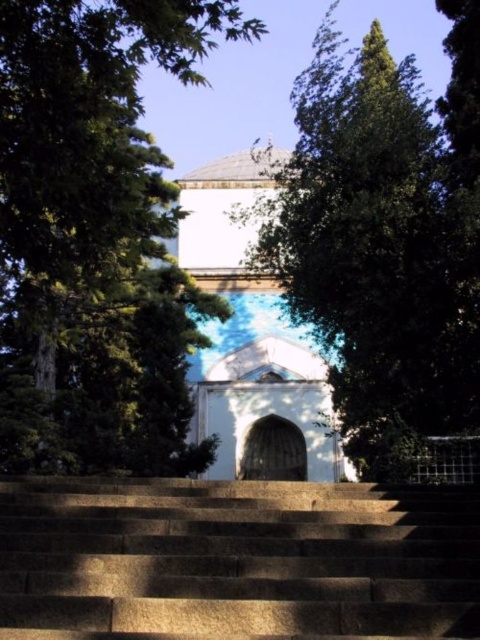
At what (x,y) coordinates should I click in order to perform the action: click on green leafy tree at center. Please return your answer as a coordinate pair (x, y). Image resolution: width=480 pixels, height=640 pixels. Looking at the image, I should click on (384, 234).

Is point (336, 392) farther from camera compared to point (241, 205)?

No, it is in front of (241, 205).

The image size is (480, 640). What do you see at coordinates (384, 234) in the screenshot? I see `green leafy tree at center` at bounding box center [384, 234].

Where is `green leafy tree at center`? The height and width of the screenshot is (640, 480). green leafy tree at center is located at coordinates (384, 234).

Can you confirm if green leafy tree at upper center is positioned to the right of white marble chapel at center?

In fact, green leafy tree at upper center is to the left of white marble chapel at center.

Which is above, green leafy tree at upper center or white marble chapel at center?

green leafy tree at upper center is higher up.

Is point (52, 51) positioned behind point (263, 300)?

No, (52, 51) is in front of (263, 300).

Image resolution: width=480 pixels, height=640 pixels. I want to click on green leafy tree at upper center, so click(96, 236).

Is brown stone stairs at center behind white marble chapel at center?

No, brown stone stairs at center is in front of white marble chapel at center.

Does point (381, 636) come behind point (288, 356)?

No, (381, 636) is in front of (288, 356).

This screenshot has width=480, height=640. What do you see at coordinates (237, 561) in the screenshot?
I see `brown stone stairs at center` at bounding box center [237, 561].

At what (x,y) coordinates should I click in order to perform the action: click on brown stone stairs at center. Please return your answer as a coordinate pair (x, y). Looking at the image, I should click on (237, 561).